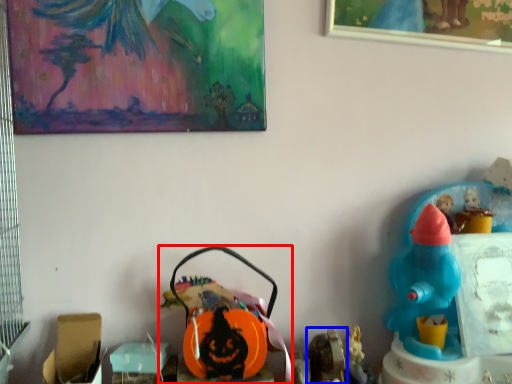
Question: Which of the following is the closest to the observer, toy (highlighted by a red box) or toy (highlighted by a blue box)?

Choices:
 (A) toy
 (B) toy

Answer: (B)